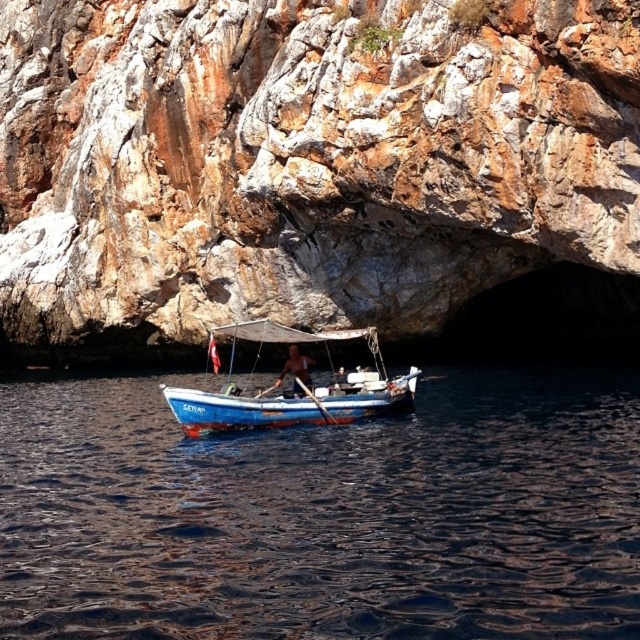
Can you confirm if dark blue water at center is positioned to the right of blue painted wood boat at center?

Incorrect, dark blue water at center is not on the right side of blue painted wood boat at center.

Can you confirm if dark blue water at center is bigger than blue painted wood boat at center?

Yes, dark blue water at center is bigger than blue painted wood boat at center.

Which is in front, point (122, 557) or point (300, 385)?

Point (122, 557)

The width and height of the screenshot is (640, 640). What are the coordinates of `dark blue water at center` in the screenshot? It's located at (324, 515).

Is point (275, 44) positioned before point (307, 376)?

No, it is behind (307, 376).

What do you see at coordinates (301, 161) in the screenshot? I see `rusty stone cave at center` at bounding box center [301, 161].

What do you see at coordinates (301, 161) in the screenshot? The image size is (640, 640). I see `rusty stone cave at center` at bounding box center [301, 161].

The height and width of the screenshot is (640, 640). Identify the location of rusty stone cave at center. (301, 161).

Which of these two, dark blue water at center or brown wooden oar at center, stands taller?

dark blue water at center is taller.

What do you see at coordinates (324, 515) in the screenshot? I see `dark blue water at center` at bounding box center [324, 515].

Who is more forward, (115, 572) or (308, 388)?

Point (115, 572)

The height and width of the screenshot is (640, 640). Find the location of `dark blue water at center`. dark blue water at center is located at coordinates (324, 515).